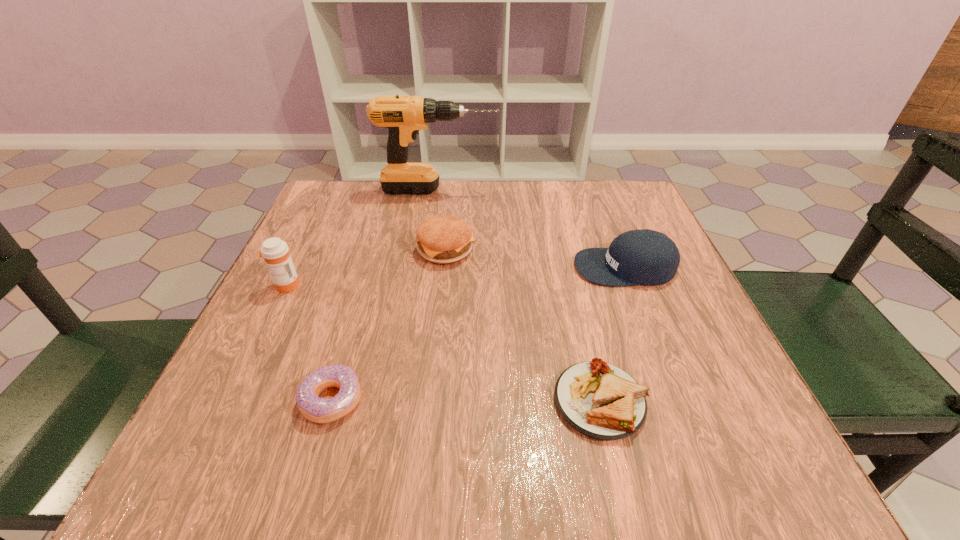
Image resolution: width=960 pixels, height=540 pixels. Find the location of `free region at the right edge`. free region at the right edge is located at coordinates pyautogui.click(x=611, y=295).

This screenshot has height=540, width=960. In order to click on blank area at the far left corner in this screenshot , I will do `click(303, 230)`.

You are a GUI agent. You are given a task and a screenshot of the screen. Output one action in this format:
    pyautogui.click(x=<x>, y=<y>)
    Task: Click on the vacant space at the far right corner of the desktop
    This screenshot has height=540, width=960.
    Given the screenshot: What is the action you would take?
    pyautogui.click(x=612, y=188)

Locate an element on the screen. The width and height of the screenshot is (960, 540). free space between the doughnut and the leftmost object is located at coordinates [x=309, y=342].

I want to click on free spot between the doughnut and the medicine, so click(309, 342).

This screenshot has width=960, height=540. I want to click on vacant space in between the sandwich and the hamburger, so click(x=523, y=326).

What are the coordinates of `free point between the second tallest object and the doughnut` in the screenshot? It's located at (309, 342).

Locate an element on the screen. The height and width of the screenshot is (540, 960). free spot between the sandwich and the doughnut is located at coordinates (466, 400).

You are a GUI agent. You are given a task and a screenshot of the screen. Output one action in this format:
    pyautogui.click(x=<x>, y=<y>)
    Task: Click on the unoccupied area between the doughnut and the drill
    The width and height of the screenshot is (960, 540).
    Given the screenshot: What is the action you would take?
    pyautogui.click(x=386, y=295)

The width and height of the screenshot is (960, 540). Find the location of `free point between the drill and the baseball cap`. free point between the drill and the baseball cap is located at coordinates (532, 228).